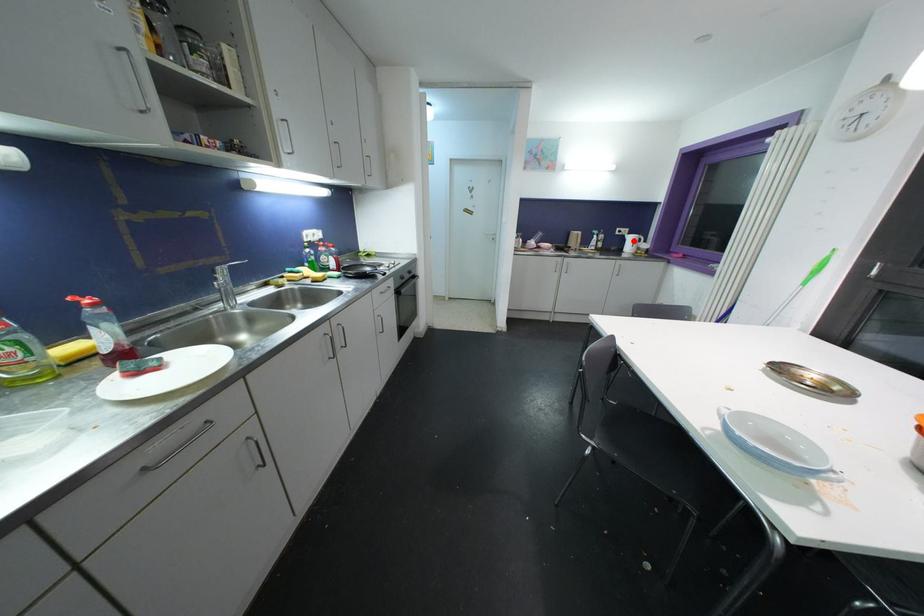
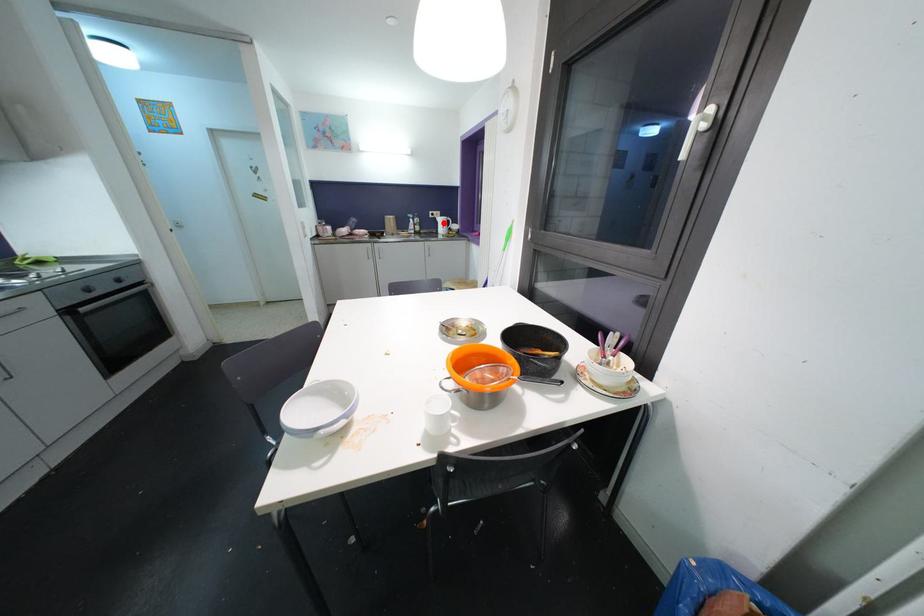
I am providing you with two images of the same scene from different viewpoints. A red point is marked on the first image and another point is marked on the second image. Is the marked point in image1 the same physical position as the marked point in image2?

Yes